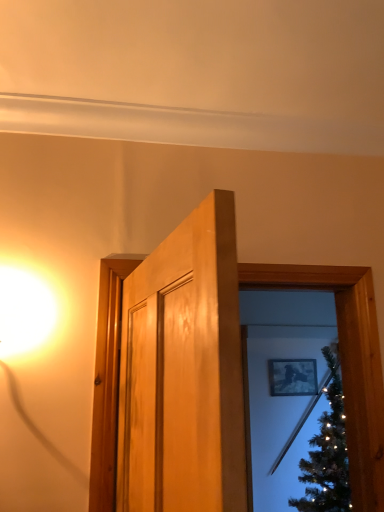
Question: In the image, is wooden door frame at center, which is counted as the 1th window frame, starting from the back, positioned in front of or behind wooden door at center, marked as the second window frame in a back-to-front arrangement?

Choices:
 (A) front
 (B) behind

Answer: (B)

Question: From the image's perspective, is wooden door frame at center, arranged as the 2th window frame when viewed from the front, located above or below wooden door at center, marked as the second window frame in a back-to-front arrangement?

Choices:
 (A) above
 (B) below

Answer: (B)

Question: Estimate the real-world distances between objects in this image. Which object is farther from the matte black picture frame at upper center?

Choices:
 (A) wooden door frame at center, arranged as the 2th window frame when viewed from the front
 (B) wooden door at center, the 1th window frame in the front-to-back sequence

Answer: (A)

Question: Based on their relative distances, which object is farther from the wooden door frame at center, which is counted as the 1th window frame, starting from the back?

Choices:
 (A) wooden door at center, the 1th window frame in the front-to-back sequence
 (B) matte black picture frame at upper center

Answer: (B)